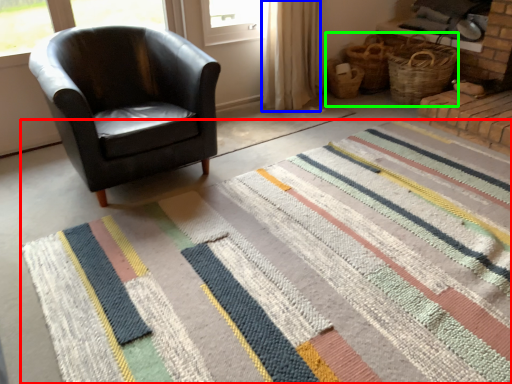
Question: Which is nearer to the doormat (highlighted by a red box)? curtain (highlighted by a blue box) or basket (highlighted by a green box).

Choices:
 (A) curtain
 (B) basket

Answer: (A)